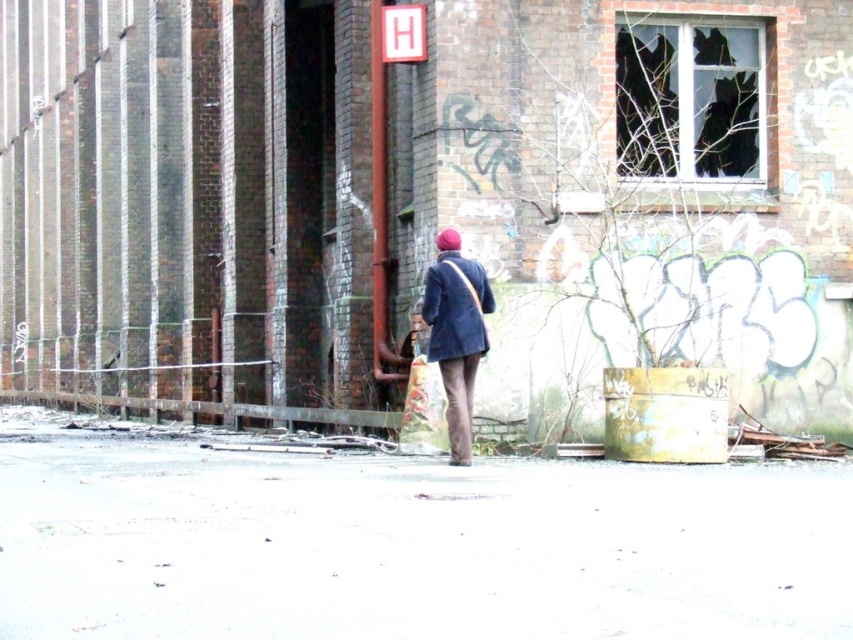
Question: Which point appears farthest from the camera in this image?

Choices:
 (A) (482, 326)
 (B) (125, 400)
 (C) (206, 604)

Answer: (B)

Question: Does concrete pavement at center appear under dark blue fabric coat at center?

Choices:
 (A) no
 (B) yes

Answer: (B)

Question: Which point is farther to the camera?

Choices:
 (A) (822, 604)
 (B) (440, 346)

Answer: (B)

Question: Among these points, which one is nearest to the camera?

Choices:
 (A) (476, 282)
 (B) (463, 259)
 (C) (178, 572)

Answer: (C)

Question: Does dark blue fabric coat at center appear on the left side of rusty metal fence at lower left?

Choices:
 (A) yes
 (B) no

Answer: (B)

Question: Observing the image, what is the correct spatial positioning of rusty metal fence at lower left in reference to dark blue woolen sweater at center?

Choices:
 (A) left
 (B) right

Answer: (A)